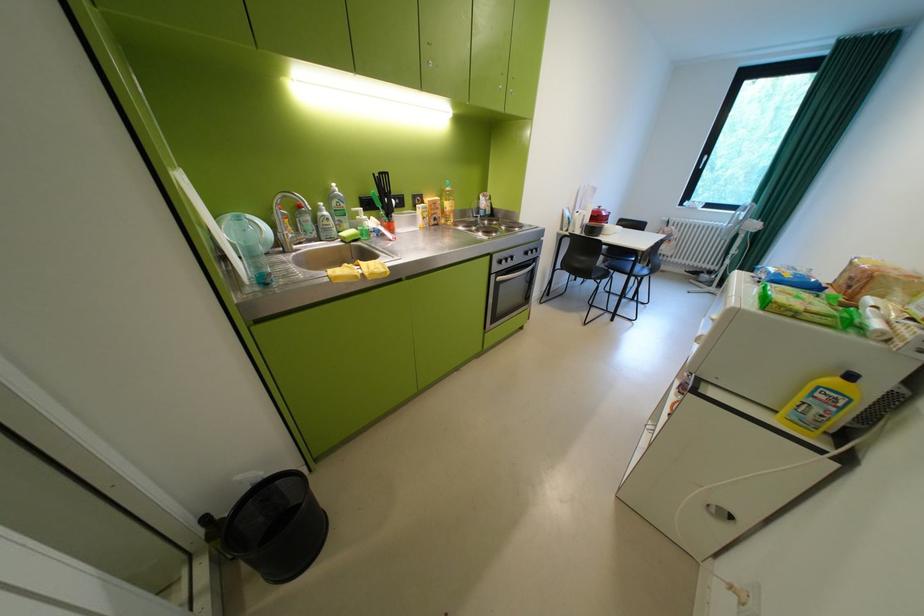
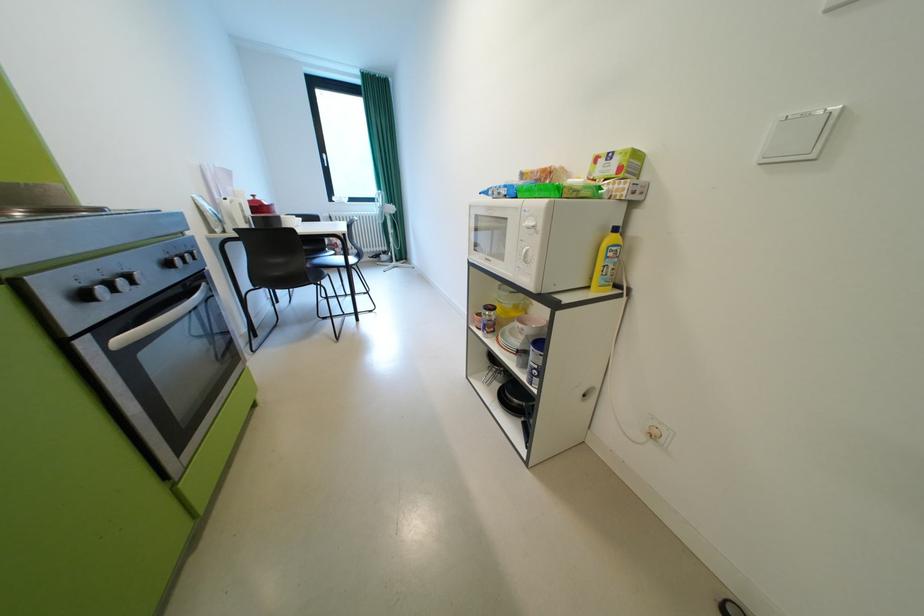
Question: The camera is either moving clockwise (left) or counter-clockwise (right) around the object. The first image is from the beginning of the video and the second image is from the end. Is the camera moving left or right when shooting the video?

Choices:
 (A) Left
 (B) Right

Answer: (A)